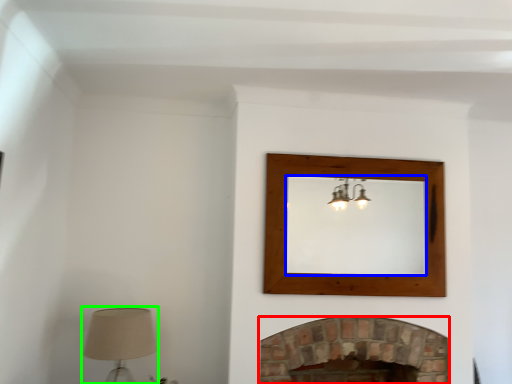
Question: Considering the real-world distances, which object is farthest from fireplace (highlighted by a red box)? mirror (highlighted by a blue box) or table lamp (highlighted by a green box)?

Choices:
 (A) mirror
 (B) table lamp

Answer: (B)